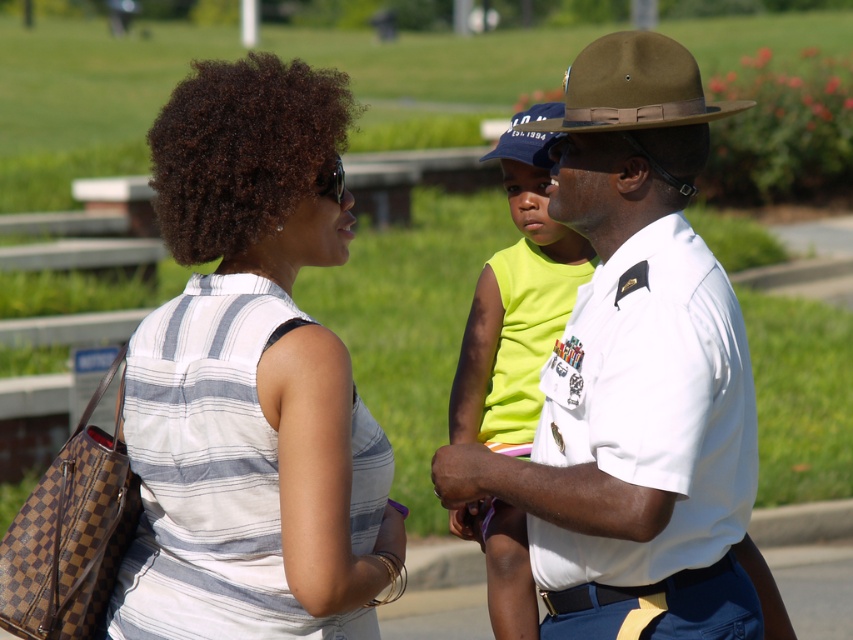
You are standing in the scene and want to find the white striped shirt at center. Based on the coordinates provided, where should you look relative to the other people in the scene?

The white striped shirt at center is located at coordinates point (251, 378), which is the center position in the scene.

Based on the scene description, which object is positioned lower in the image between the white striped shirt at center and the brown leather cowboy hat at upper center?

The white striped shirt at center is positioned lower than the brown leather cowboy hat at upper center.